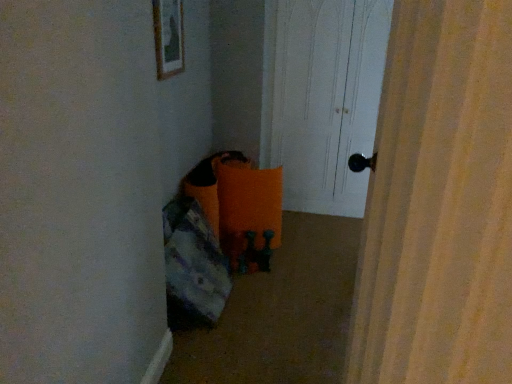
Question: From the image's perspective, is matte wooden picture frame at upper center on top of orange fabric bean bag at lower left?

Choices:
 (A) yes
 (B) no

Answer: (A)

Question: Can you confirm if matte wooden picture frame at upper center is smaller than orange fabric bean bag at lower left?

Choices:
 (A) yes
 (B) no

Answer: (A)

Question: Can you confirm if matte wooden picture frame at upper center is shorter than orange fabric bean bag at lower left?

Choices:
 (A) no
 (B) yes

Answer: (B)

Question: Is matte wooden picture frame at upper center closer to the viewer compared to orange fabric bean bag at lower left?

Choices:
 (A) yes
 (B) no

Answer: (B)

Question: Can we say matte wooden picture frame at upper center lies outside orange fabric bean bag at lower left?

Choices:
 (A) no
 (B) yes

Answer: (B)

Question: From a real-world perspective, relative to orange fabric bean bag at lower left, is white wood door at center vertically above or below?

Choices:
 (A) below
 (B) above

Answer: (B)

Question: Does point (346, 157) appear closer or farther from the camera than point (204, 225)?

Choices:
 (A) farther
 (B) closer

Answer: (A)

Question: Is white wood door at center bigger or smaller than orange fabric bean bag at lower left?

Choices:
 (A) small
 (B) big

Answer: (B)

Question: Is white wood door at center spatially inside orange fabric bean bag at lower left, or outside of it?

Choices:
 (A) inside
 (B) outside

Answer: (B)

Question: Looking at the image, does matte wooden picture frame at upper center seem bigger or smaller compared to orange fabric bean bag at lower left?

Choices:
 (A) big
 (B) small

Answer: (B)

Question: In the image, is matte wooden picture frame at upper center positioned in front of or behind orange fabric bean bag at lower left?

Choices:
 (A) front
 (B) behind

Answer: (B)

Question: Is point (181, 26) positioned closer to the camera than point (179, 238)?

Choices:
 (A) farther
 (B) closer

Answer: (A)

Question: From the image's perspective, is matte wooden picture frame at upper center above or below orange fabric bean bag at lower left?

Choices:
 (A) above
 (B) below

Answer: (A)

Question: Is white wood door at center inside the boundaries of matte wooden picture frame at upper center, or outside?

Choices:
 (A) outside
 (B) inside

Answer: (A)

Question: Is white wood door at center taller or shorter than matte wooden picture frame at upper center?

Choices:
 (A) tall
 (B) short

Answer: (A)